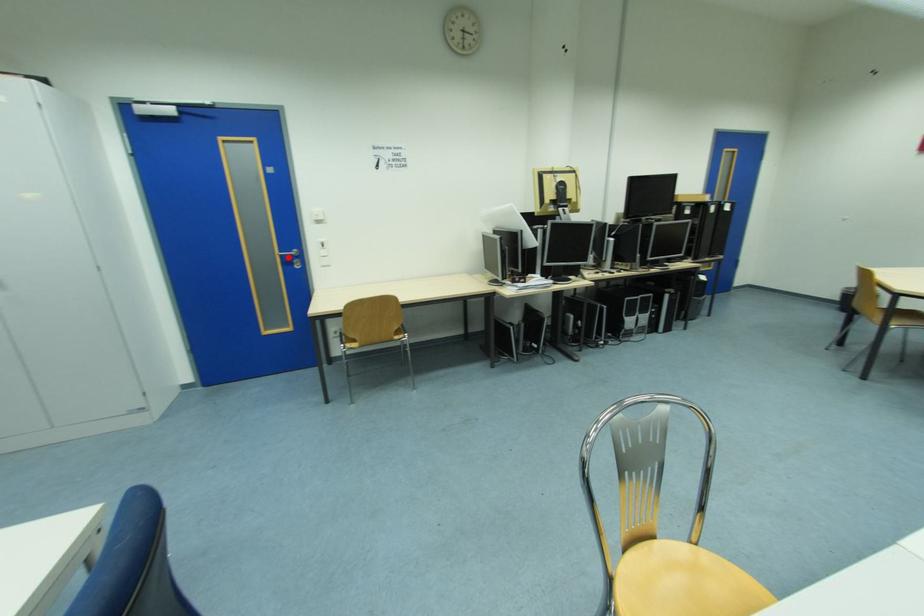
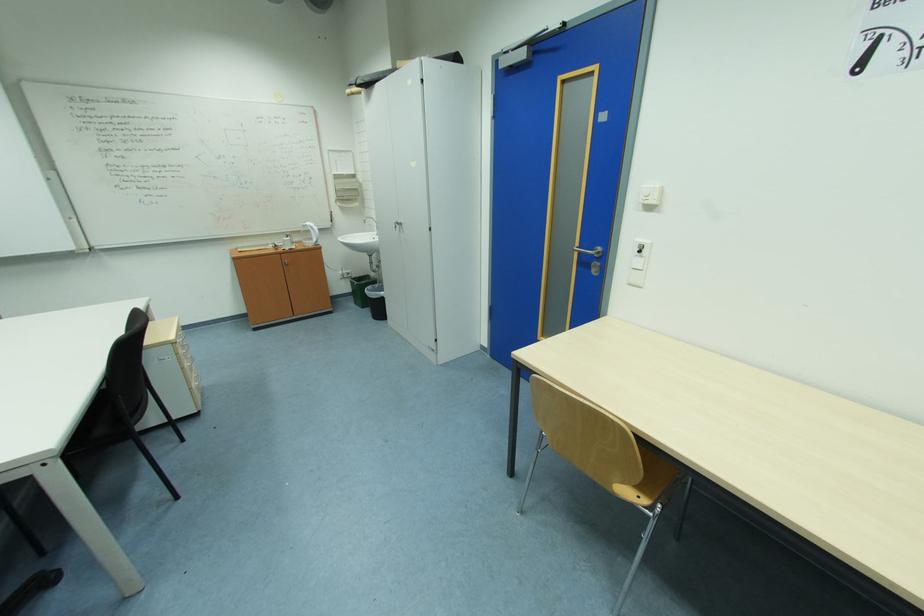
The point at the highlighted location is marked in the first image. Where is the corresponding point in the second image?

(587, 253)